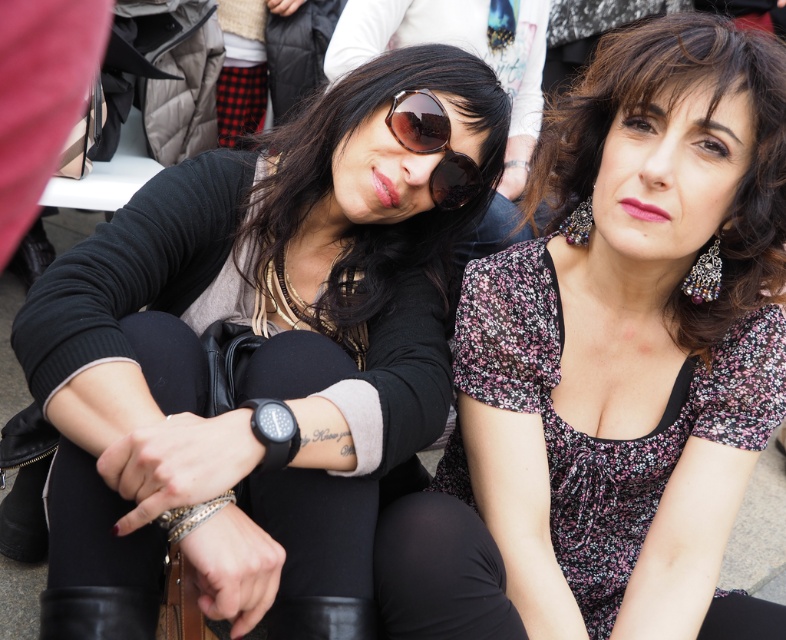
What are the coordinates of `floral-patterned fabric top at center` in the screenshot? It's located at (632, 340).

Locate an element on the screen. This screenshot has height=640, width=786. floral-patterned fabric top at center is located at coordinates (632, 340).

Identify the location of floral-patterned fabric top at center. (632, 340).

Between point (270, 552) and point (750, 232), which one is positioned in front?

Point (270, 552)

Find the location of a particular element. matte black sweater at left is located at coordinates (263, 355).

Does matte black sweater at left have a larger size compared to pearl-like beaded earring at upper right?

Correct, matte black sweater at left is larger in size than pearl-like beaded earring at upper right.

Does matte black sweater at left appear over pearl-like beaded earring at upper right?

No.

This screenshot has height=640, width=786. In order to click on matte black sweater at left in this screenshot , I will do `click(263, 355)`.